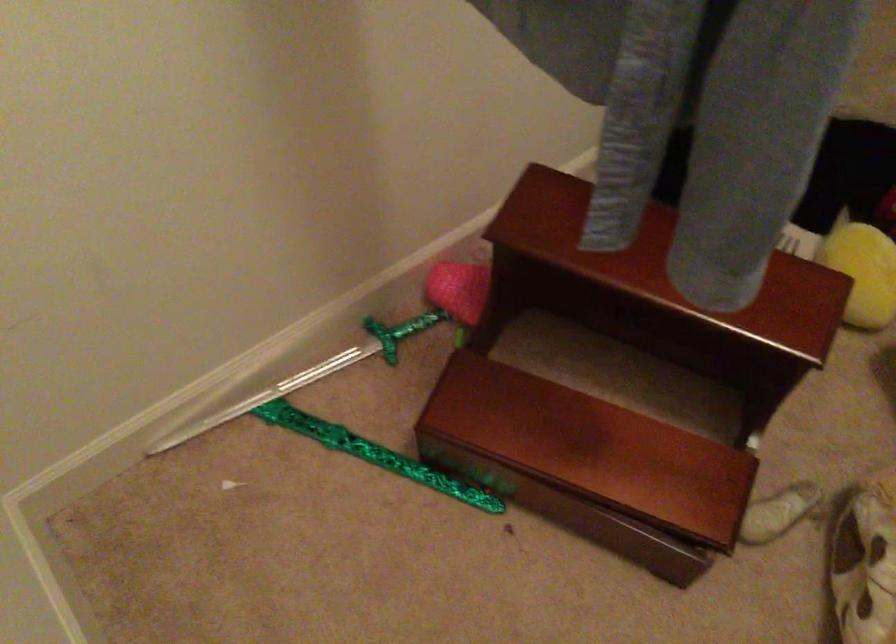
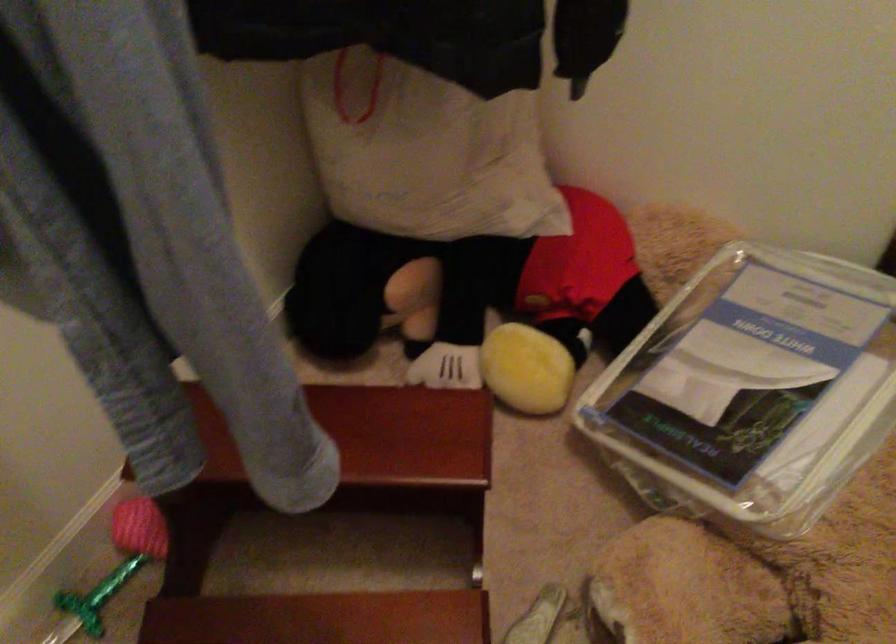
Question: In a continuous first-person perspective shot, in which direction is the camera moving?

Choices:
 (A) Left
 (B) Right
 (C) Forward
 (D) Backward

Answer: (B)